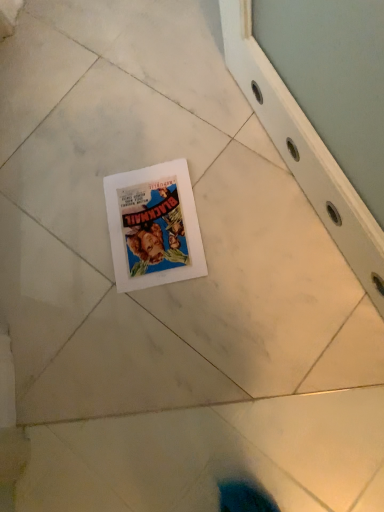
At what (x,y) coordinates should I click in order to perform the action: click on vacant space situated above matte paper comic book at center (from a real-world perspective). Please return your answer as a coordinate pair (x, y). This screenshot has height=512, width=384. Looking at the image, I should click on (148, 221).